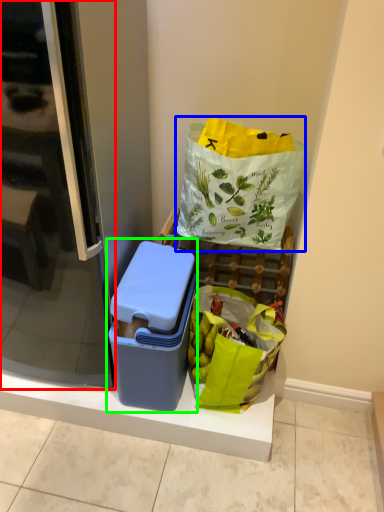
Question: Based on their relative distances, which object is farther from screen door (highlighted by a red box)? Choose from plastic bag (highlighted by a blue box) and lunch box (highlighted by a green box).

Choices:
 (A) plastic bag
 (B) lunch box

Answer: (A)